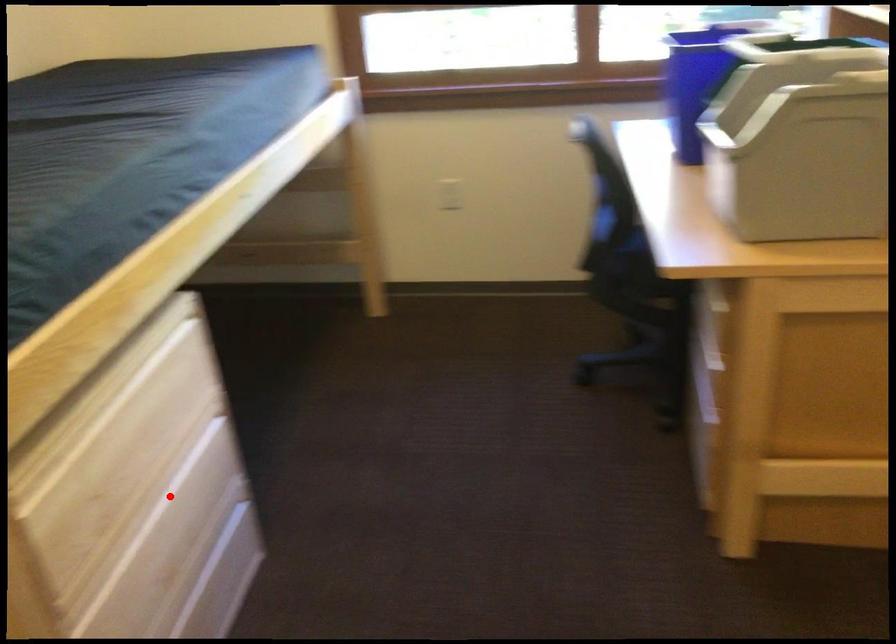
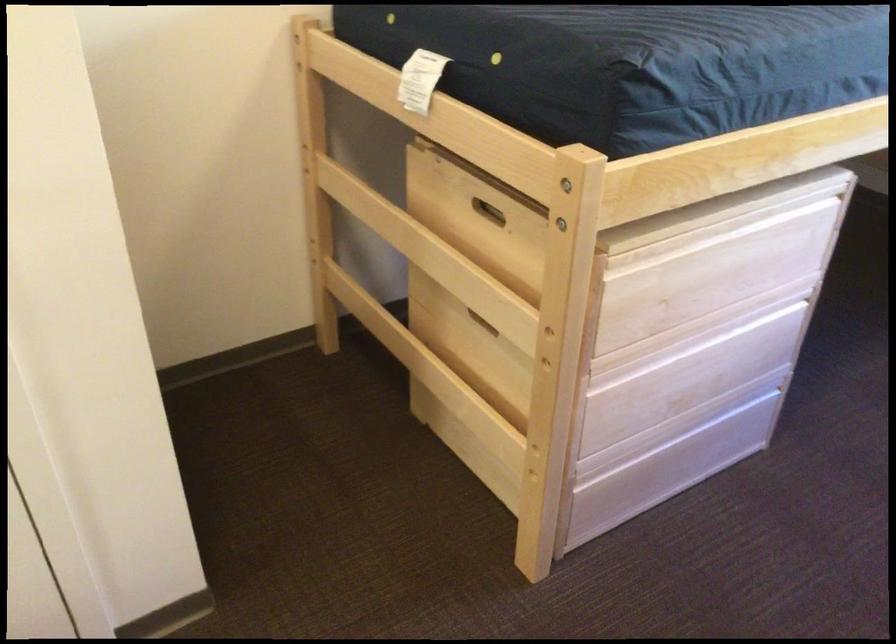
In the second image, find the point that corresponds to the highlighted location in the first image.

(718, 342)